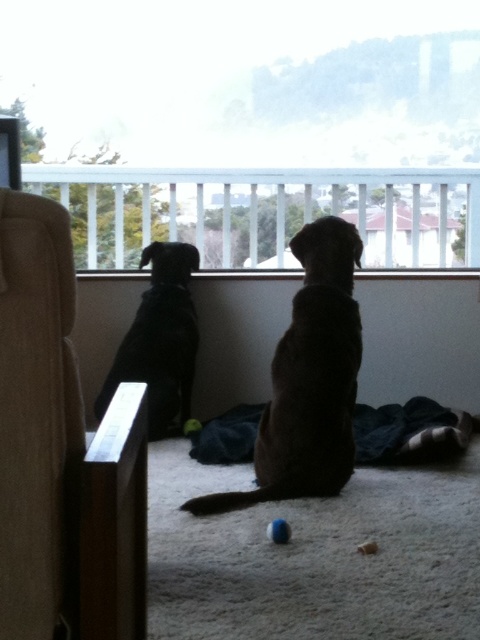
Between beige fabric armchair at left and rubber ball at center, which one is positioned higher?

beige fabric armchair at left is above.

I want to click on beige fabric armchair at left, so click(58, 454).

Identify the location of beige fabric armchair at left. Image resolution: width=480 pixels, height=640 pixels. (58, 454).

What do you see at coordinates (159, 339) in the screenshot?
I see `black matte dog at left` at bounding box center [159, 339].

Locate an element on the screen. black matte dog at left is located at coordinates (159, 339).

Find the location of a particular element. black matte dog at left is located at coordinates (159, 339).

Can you confirm if beige fabric armchair at left is taller than blue rubber ball at center?

Correct, beige fabric armchair at left is much taller as blue rubber ball at center.

Where is `beige fabric armchair at left`? beige fabric armchair at left is located at coordinates (x=58, y=454).